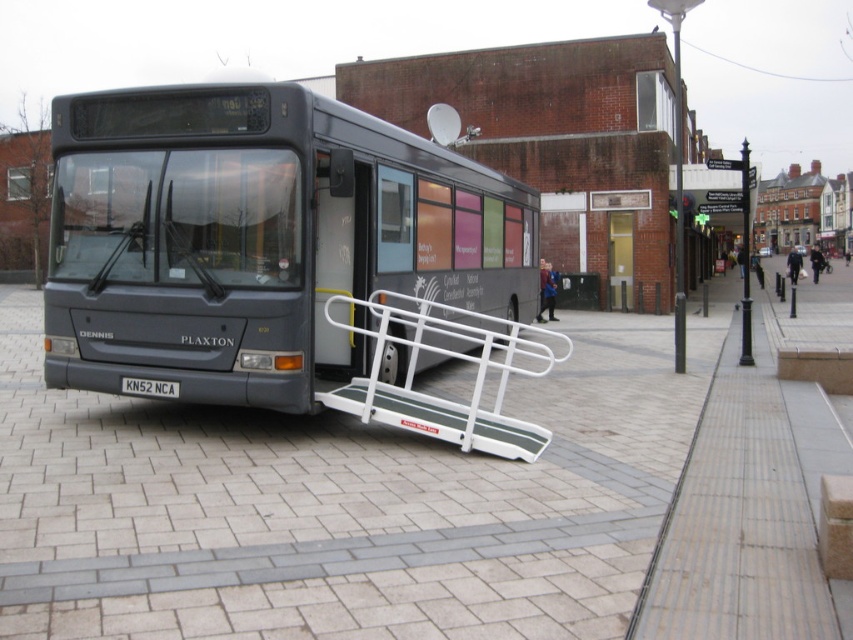
Which is behind, point (670, 438) or point (234, 99)?

The point (670, 438) is more distant.

Which is in front, point (219, 564) or point (180, 156)?

Positioned in front is point (219, 564).

This screenshot has height=640, width=853. I want to click on gray brick pavement at center, so click(x=341, y=502).

I want to click on gray brick pavement at center, so point(341,502).

Is gray brick pavement at center to the right of black metal pole at upper right from the viewer's perspective?

Incorrect, gray brick pavement at center is not on the right side of black metal pole at upper right.

Is point (27, 394) positioned after point (747, 145)?

No, it is not.

Locate an element on the screen. The height and width of the screenshot is (640, 853). gray brick pavement at center is located at coordinates (341, 502).

Does matte black bus at center appear over black metal pole at upper right?

No, matte black bus at center is not above black metal pole at upper right.

Is matte black bus at center thinner than black metal pole at upper right?

Yes, matte black bus at center is thinner than black metal pole at upper right.

Which is behind, point (369, 132) or point (677, 179)?

Point (677, 179)

Where is `matte black bus at center`? This screenshot has width=853, height=640. matte black bus at center is located at coordinates (x=257, y=240).